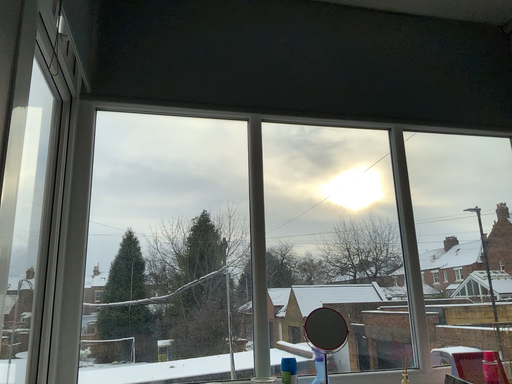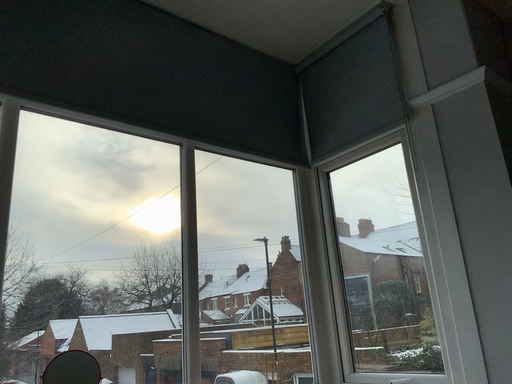
Question: Which way did the camera rotate in the video?

Choices:
 (A) rotated right
 (B) rotated left

Answer: (A)